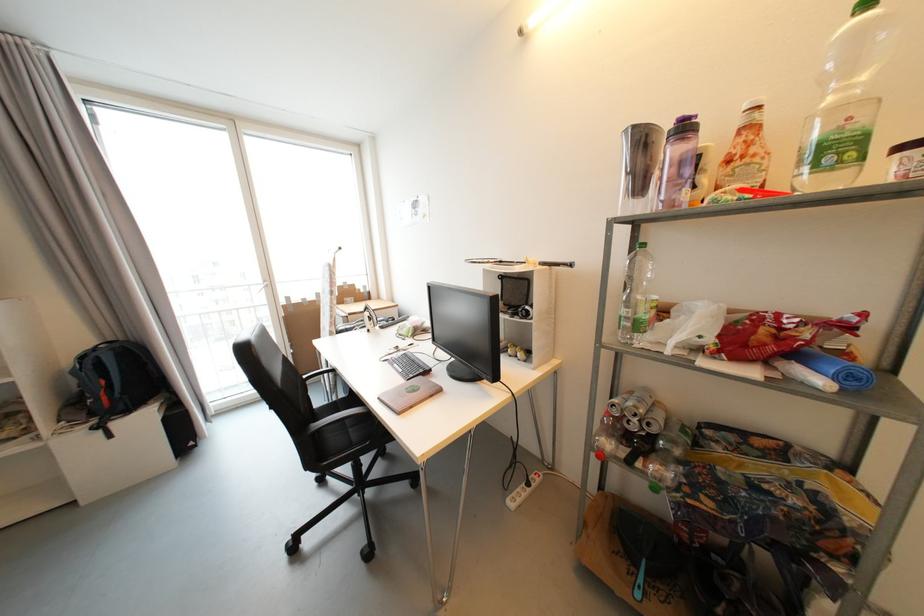
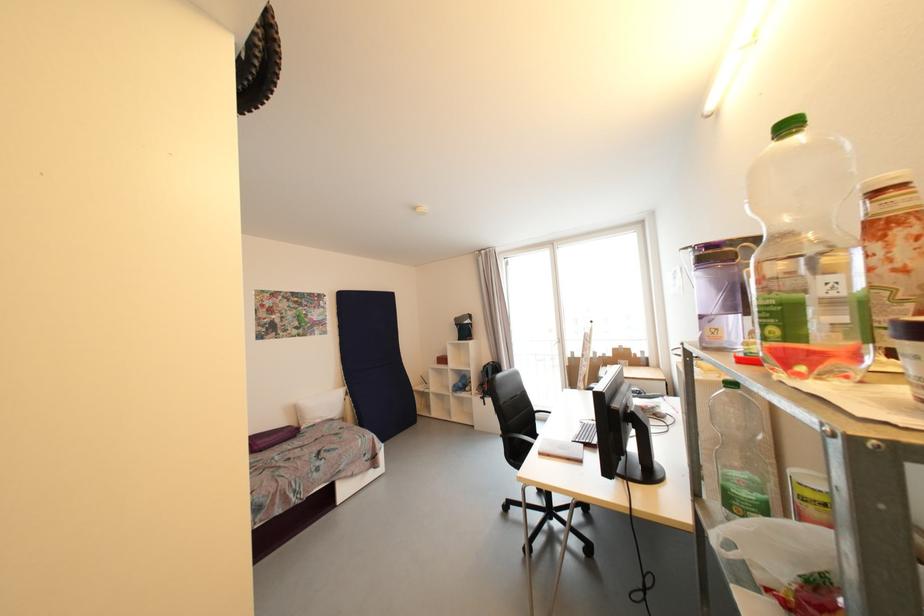
Locate, in the second image, the point that corresponds to point (89, 359) in the first image.

(490, 368)